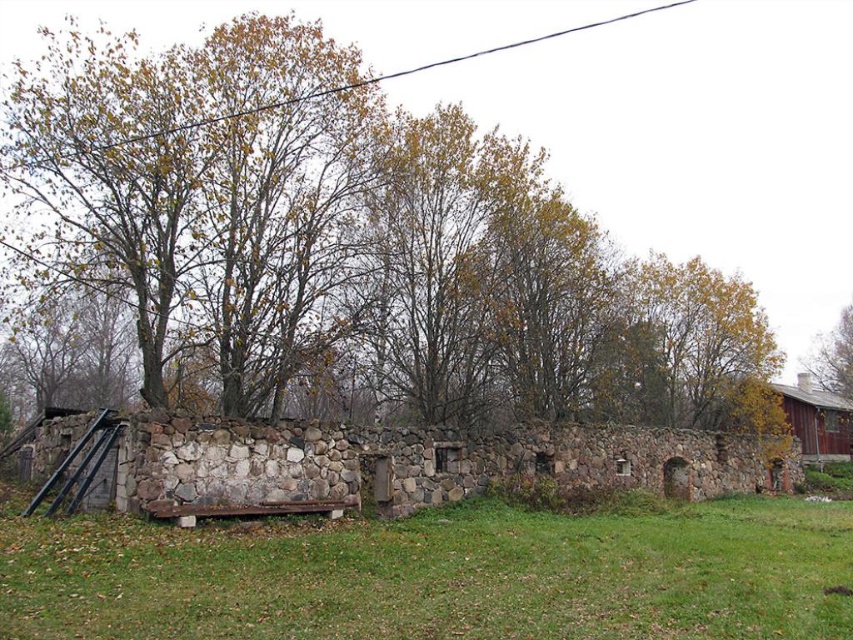
Is brown leafy tree at upper left thinner than brown leafy tree at upper right?

No, brown leafy tree at upper left is not thinner than brown leafy tree at upper right.

Between point (546, 188) and point (840, 330), which one is positioned in front?

Point (546, 188) is in front.

Find the location of a particular element. The height and width of the screenshot is (640, 853). brown leafy tree at upper left is located at coordinates (349, 243).

Does brown leafy tree at upper left have a larger size compared to brown wooden barn at right?

Yes, brown leafy tree at upper left is bigger than brown wooden barn at right.

Which of these two, brown leafy tree at upper left or brown wooden barn at right, stands shorter?

brown wooden barn at right

Where is `brown leafy tree at upper left`? brown leafy tree at upper left is located at coordinates (349, 243).

The image size is (853, 640). Find the location of `brown leafy tree at upper left`. brown leafy tree at upper left is located at coordinates (349, 243).

Who is positioned more to the right, brown leafy tree at upper left or green grass at lower center?

green grass at lower center is more to the right.

You are a GUI agent. You are given a task and a screenshot of the screen. Output one action in this format:
    pyautogui.click(x=<x>, y=<y>)
    Task: Click on the brown leafy tree at upper left
    
    Given the screenshot: What is the action you would take?
    pyautogui.click(x=349, y=243)